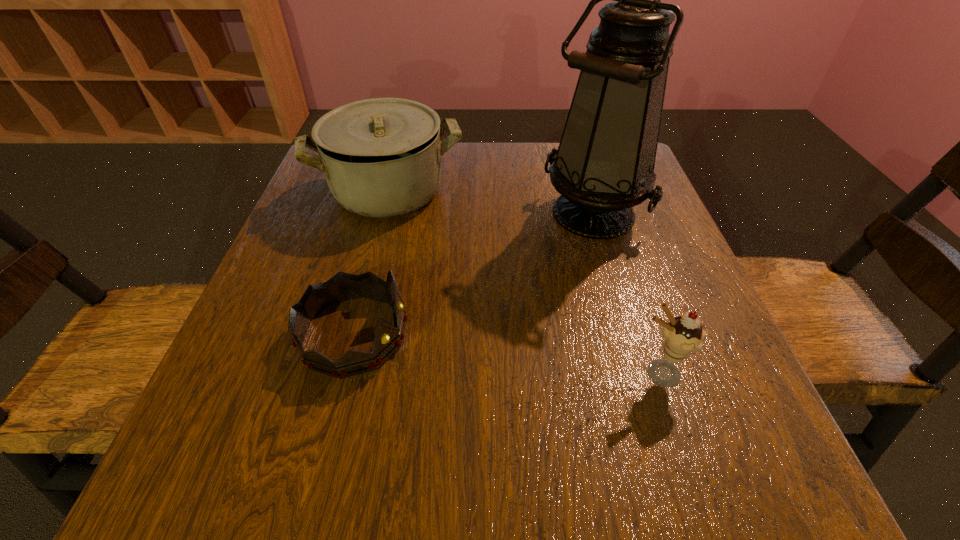
The image size is (960, 540). I want to click on saucepan that is at the left edge, so click(x=381, y=157).

Locate an element on the screen. This screenshot has height=540, width=960. tiara that is at the left edge is located at coordinates (318, 297).

Find the location of a particular element. oil lamp present at the right edge is located at coordinates (604, 165).

This screenshot has height=540, width=960. I want to click on icecream at the right edge, so click(x=682, y=335).

Locate an element on the screen. This screenshot has height=540, width=960. object that is at the far left corner is located at coordinates (381, 157).

Identify the location of object that is at the far right corner. The height and width of the screenshot is (540, 960). (604, 165).

This screenshot has height=540, width=960. In the image, there is a desktop. Identify the location of blank space at the far edge. (490, 176).

The width and height of the screenshot is (960, 540). In order to click on vacant region at the near edge of the desktop in this screenshot , I will do `click(420, 470)`.

The width and height of the screenshot is (960, 540). What are the coordinates of `vacant region at the left edge of the desktop` in the screenshot? It's located at (300, 366).

Image resolution: width=960 pixels, height=540 pixels. Identify the location of vacant region at the right edge of the desktop. (666, 298).